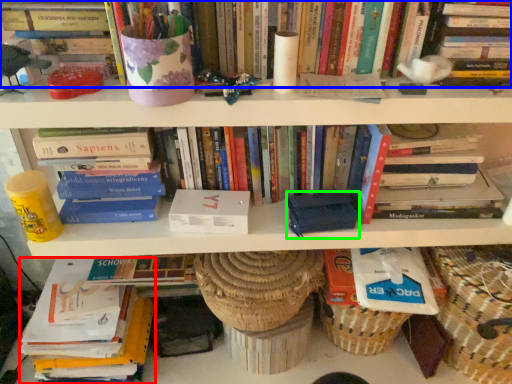
Question: Estimate the real-world distances between objects in this image. Which object is closer to book (highlighted by a red box), book (highlighted by a blue box) or paperback book (highlighted by a green box)?

Choices:
 (A) book
 (B) paperback book

Answer: (B)